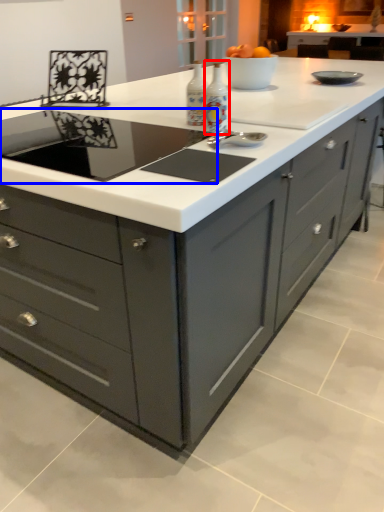
Question: Which point is further to the camera, appliance (highlighted by a red box) or home appliance (highlighted by a blue box)?

Choices:
 (A) appliance
 (B) home appliance

Answer: (A)